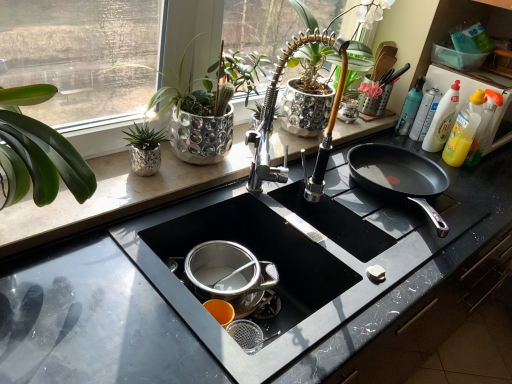
How much space does silver textured pot at upper left, marked as the 1th houseplant in a right-to-left arrangement, occupy vertically?

silver textured pot at upper left, marked as the 1th houseplant in a right-to-left arrangement, is 14.29 inches in height.

The height and width of the screenshot is (384, 512). What do you see at coordinates (442, 120) in the screenshot?
I see `translucent plastic bottle at upper right` at bounding box center [442, 120].

Measure the distance between translucent plastic bottle at upper right and camera.

A distance of 5.02 feet exists between translucent plastic bottle at upper right and camera.

Describe the element at coordinates (275, 287) in the screenshot. The height and width of the screenshot is (384, 512). I see `black marble countertop at center` at that location.

This screenshot has width=512, height=384. In order to click on translucent plastic bottle at upper right in this screenshot , I will do `click(410, 107)`.

Locate an element on the screen. The height and width of the screenshot is (384, 512). yellow plastic bottle at right is located at coordinates pos(473,92).

Locate an element on the screen. Image resolution: width=512 pixels, height=384 pixels. green glossy plant at upper left, acting as the second houseplant starting from the right is located at coordinates (145, 149).

Looking at this image, is black marble countertop at center positioned in front of translucent plastic bottle at upper right?

Yes, it is.

From a real-world perspective, which is physically above, black marble countertop at center or translucent plastic bottle at upper right?

In real-world perspective, translucent plastic bottle at upper right is above.

In terms of height, does black marble countertop at center look taller or shorter compared to translucent plastic bottle at upper right?

Considering their sizes, black marble countertop at center has more height than translucent plastic bottle at upper right.

Is black marble countertop at center oriented away from translucent plastic bottle at upper right?

No, black marble countertop at center is not facing the opposite direction of translucent plastic bottle at upper right.

Between black granite countertop at center and translucent plastic bottle at upper right, which one has more height?

Standing taller between the two is translucent plastic bottle at upper right.

Is black granite countertop at center in front of or behind translucent plastic bottle at upper right in the image?

Visually, black granite countertop at center is located in front of translucent plastic bottle at upper right.

Would you say black granite countertop at center is to the left or to the right of translucent plastic bottle at upper right in the picture?

In the image, black granite countertop at center appears on the left side of translucent plastic bottle at upper right.

The height and width of the screenshot is (384, 512). I want to click on counter top beneath the translucent plastic bottle at upper right (from a real-world perspective), so click(x=117, y=195).

Considering the sizes of objects translucent plastic bottle at upper right and black marble countertop at center in the image provided, who is thinner, translucent plastic bottle at upper right or black marble countertop at center?

With smaller width is translucent plastic bottle at upper right.

Is translucent plastic bottle at upper right directly adjacent to black marble countertop at center?

They are not placed beside each other.

Between translucent plastic bottle at upper right and black marble countertop at center, which one appears on the left side from the viewer's perspective?

From the viewer's perspective, black marble countertop at center appears more on the left side.

Measure the distance from translucent plastic bottle at upper right to black marble countertop at center.

The distance of translucent plastic bottle at upper right from black marble countertop at center is 81.12 centimeters.

Considering the points (453, 93) and (416, 110), which point is in front, point (453, 93) or point (416, 110)?

Point (453, 93)

From the image's perspective, would you say translucent plastic bottle at upper right is positioned over translucent plastic bottle at upper right?

No, from the image's perspective, translucent plastic bottle at upper right is not over translucent plastic bottle at upper right.

Is translucent plastic bottle at upper right wider than translucent plastic bottle at upper right?

Correct, the width of translucent plastic bottle at upper right exceeds that of translucent plastic bottle at upper right.

This screenshot has height=384, width=512. I want to click on cleaning product positioned vertically above the translucent plastic bottle at upper right (from a real-world perspective), so click(442, 120).

Is silver textured pot at upper left, which ranks as the second houseplant in left-to-right order, shorter than green glossy plant at upper left, placed as the first houseplant when sorted from left to right?

No, silver textured pot at upper left, which ranks as the second houseplant in left-to-right order, is not shorter than green glossy plant at upper left, placed as the first houseplant when sorted from left to right.

From the image's perspective, does silver textured pot at upper left, marked as the 1th houseplant in a right-to-left arrangement, appear lower than green glossy plant at upper left, placed as the first houseplant when sorted from left to right?

Actually, silver textured pot at upper left, marked as the 1th houseplant in a right-to-left arrangement, appears above green glossy plant at upper left, placed as the first houseplant when sorted from left to right, in the image.

Is silver textured pot at upper left, marked as the 1th houseplant in a right-to-left arrangement, next to green glossy plant at upper left, acting as the second houseplant starting from the right?

There is a gap between silver textured pot at upper left, marked as the 1th houseplant in a right-to-left arrangement, and green glossy plant at upper left, acting as the second houseplant starting from the right.

Between silver textured pot at upper left, which ranks as the second houseplant in left-to-right order, and green glossy plant at upper left, acting as the second houseplant starting from the right, which one has smaller size?

With smaller size is green glossy plant at upper left, acting as the second houseplant starting from the right.

From a real-world perspective, is translucent plastic bottle at upper right physically located above or below silver textured pot at upper left, marked as the 1th houseplant in a right-to-left arrangement?

translucent plastic bottle at upper right is situated lower than silver textured pot at upper left, marked as the 1th houseplant in a right-to-left arrangement, in the real world.

Could silver textured pot at upper left, marked as the 1th houseplant in a right-to-left arrangement, be considered to be inside translucent plastic bottle at upper right?

No, silver textured pot at upper left, marked as the 1th houseplant in a right-to-left arrangement, is not inside translucent plastic bottle at upper right.

From the translucent plastic bottle at upper right, count the 1st houseplant to the left and point to it. Please provide its 2D coordinates.

[(208, 107)]

Which is farther from the camera, (x=408, y=132) or (x=194, y=129)?

The point (x=408, y=132) is farther.

Who is bigger, black granite countertop at center or green glossy plant at upper left, acting as the second houseplant starting from the right?

black granite countertop at center.

In the scene shown: Can you see black granite countertop at center touching green glossy plant at upper left, placed as the first houseplant when sorted from left to right?

No, black granite countertop at center is not beside green glossy plant at upper left, placed as the first houseplant when sorted from left to right.

Based on their positions, is black granite countertop at center located to the left or right of green glossy plant at upper left, placed as the first houseplant when sorted from left to right?

Based on their positions, black granite countertop at center is located to the right of green glossy plant at upper left, placed as the first houseplant when sorted from left to right.

Is black granite countertop at center further to camera compared to green glossy plant at upper left, acting as the second houseplant starting from the right?

No, black granite countertop at center is closer to the viewer.

Where is `bottle lying above the black marble countertop at center (from the image's perspective)`? bottle lying above the black marble countertop at center (from the image's perspective) is located at coordinates (410, 107).

Where is `bottle located on the right of black granite countertop at center`? bottle located on the right of black granite countertop at center is located at coordinates (410, 107).

Based on their spatial positions, is green glossy plant at upper left, acting as the second houseplant starting from the right, or black marble countertop at center closer to translucent plastic bottle at upper right?

Based on the image, black marble countertop at center appears to be nearer to translucent plastic bottle at upper right.

Estimate the real-world distances between objects in this image. Which object is closer to silver textured pot at upper left, marked as the 1th houseplant in a right-to-left arrangement, black marble countertop at center or translucent plastic bottle at upper right?

black marble countertop at center lies closer to silver textured pot at upper left, marked as the 1th houseplant in a right-to-left arrangement, than the other object.

Consider the image. Which object lies nearer to the anchor point yellow plastic bottle at right, silver textured pot at upper left, marked as the 1th houseplant in a right-to-left arrangement, or black granite countertop at center?

The object closer to yellow plastic bottle at right is black granite countertop at center.

Which object lies further to the anchor point translucent plastic bottle at upper right, yellow plastic bottle at right or translucent plastic bottle at upper right?

Based on the image, translucent plastic bottle at upper right appears to be further to translucent plastic bottle at upper right.

When comparing their distances from translucent plastic bottle at upper right, does translucent plastic bottle at upper right or green glossy plant at upper left, placed as the first houseplant when sorted from left to right, seem further?

green glossy plant at upper left, placed as the first houseplant when sorted from left to right, lies further to translucent plastic bottle at upper right than the other object.

Which object lies further to the anchor point yellow plastic bottle at right, translucent plastic bottle at upper right or translucent plastic bottle at upper right?

translucent plastic bottle at upper right is further to yellow plastic bottle at right.

Looking at the image, which one is located closer to translucent plastic bottle at upper right, black granite countertop at center or yellow plastic bottle at right?

yellow plastic bottle at right.

When comparing their distances from black marble countertop at center, does translucent plastic bottle at upper right or yellow plastic bottle at right seem further?

translucent plastic bottle at upper right is positioned further to the anchor black marble countertop at center.

I want to click on bottle located between silver textured pot at upper left, marked as the 1th houseplant in a right-to-left arrangement, and yellow plastic bottle at right in the left-right direction, so click(410, 107).

Locate an element on the screen. The height and width of the screenshot is (384, 512). bottle between black granite countertop at center and yellow plastic bottle at right is located at coordinates (410, 107).

In order to click on cleaning product between green glossy plant at upper left, placed as the first houseplant when sorted from left to right, and yellow plastic bottle at right, in the horizontal direction in this screenshot , I will do `click(442, 120)`.

In order to click on counter top situated between silver textured pot at upper left, marked as the 1th houseplant in a right-to-left arrangement, and translucent plastic bottle at upper right from left to right in this screenshot , I will do `click(117, 195)`.